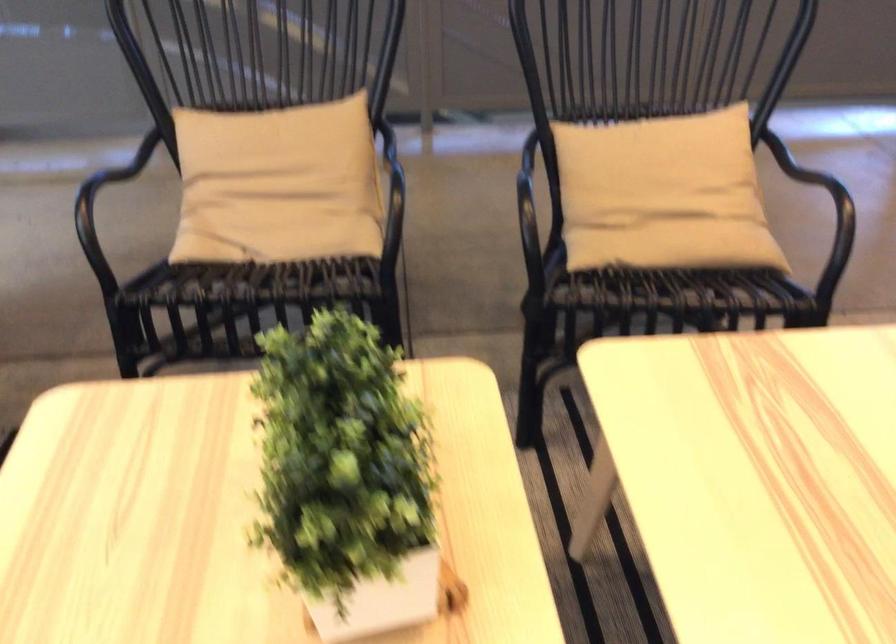
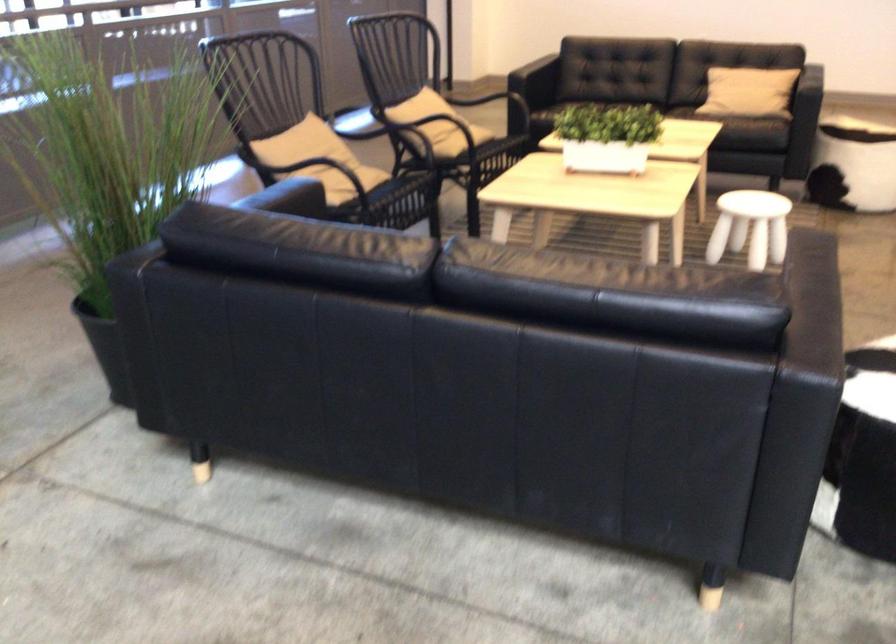
Find the pixel in the second image that matches point (125, 307) in the first image.

(382, 204)